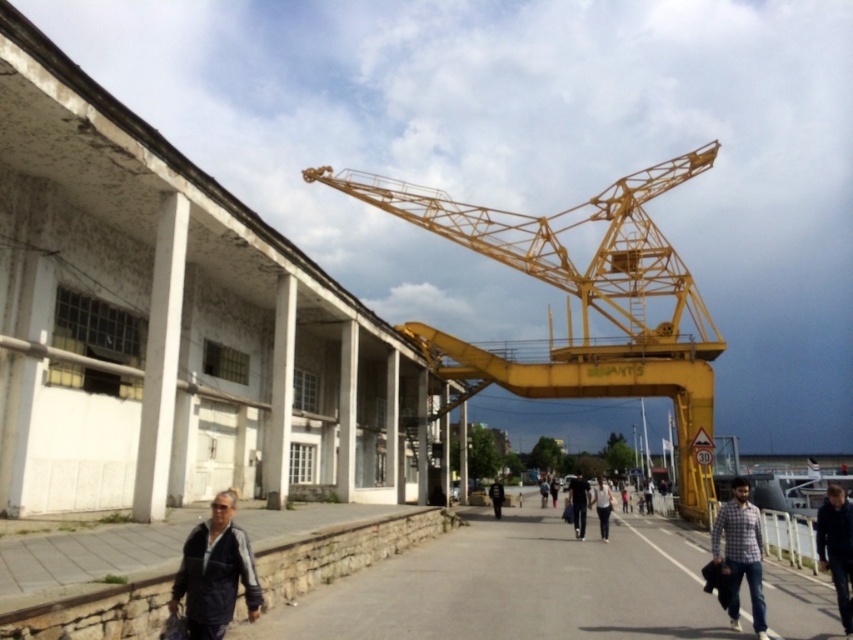
Can you confirm if dark blue jeans at center is positioned to the left of light blue jeans at center?

Indeed, dark blue jeans at center is positioned on the left side of light blue jeans at center.

Is point (589, 493) behind point (605, 497)?

Yes, it is.

Find the location of a particular element. The width and height of the screenshot is (853, 640). dark blue jeans at center is located at coordinates (579, 502).

Can you confirm if dark blue jacket at lower right is smaller than black leather jacket at center?

Yes, dark blue jacket at lower right is smaller than black leather jacket at center.

Which is above, dark blue jacket at lower right or black leather jacket at center?

dark blue jacket at lower right

At what (x,y) coordinates should I click in order to perform the action: click on dark blue jacket at lower right. Please return your answer as a coordinate pair (x, y). Looking at the image, I should click on (x=837, y=548).

Does yellow metallic crane at center appear over dark gray jacket at lower left?

Correct, yellow metallic crane at center is located above dark gray jacket at lower left.

Which is below, yellow metallic crane at center or dark gray jacket at lower left?

dark gray jacket at lower left is below.

Is point (602, 278) less distant than point (218, 624)?

No, it is behind (218, 624).

Identify the location of yellow metallic crane at center. The width and height of the screenshot is (853, 640). (582, 301).